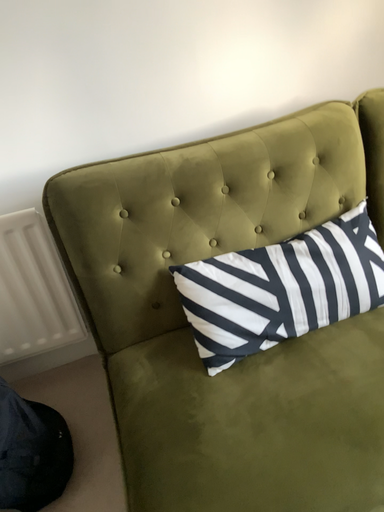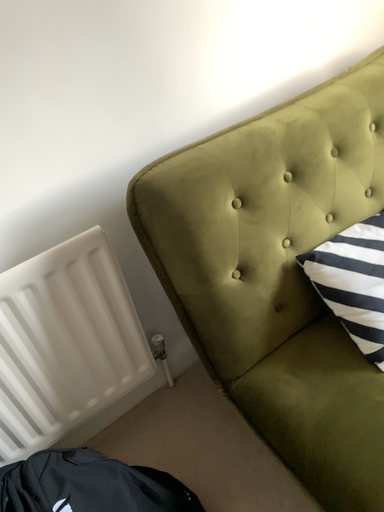
Question: How did the camera likely rotate when shooting the video?

Choices:
 (A) rotated left
 (B) rotated right

Answer: (B)